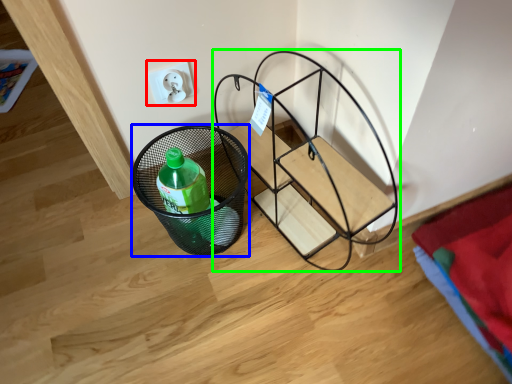
Question: Which object is positioned farthest from electric outlet (highlighted by a red box)? Select from basket (highlighted by a blue box) and furniture (highlighted by a green box).

Choices:
 (A) basket
 (B) furniture

Answer: (B)